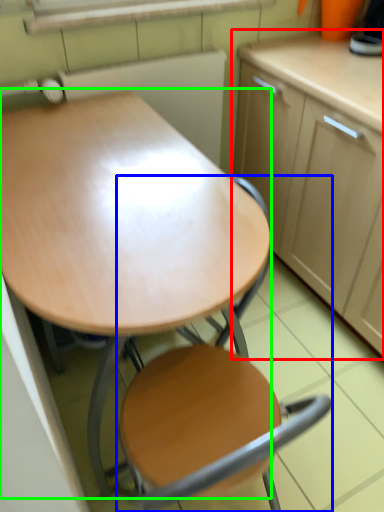
Question: Based on their relative distances, which object is nearer to cabinetry (highlighted by a red box)? Choose from chair (highlighted by a blue box) and desk (highlighted by a green box).

Choices:
 (A) chair
 (B) desk

Answer: (B)